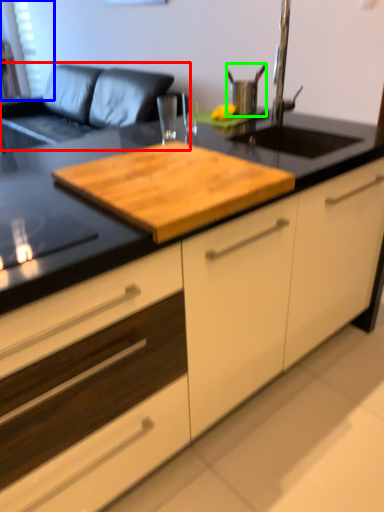
Question: Considering the real-world distances, which object is closest to couch (highlighted by a red box)? window screen (highlighted by a blue box) or appliance (highlighted by a green box).

Choices:
 (A) window screen
 (B) appliance

Answer: (A)